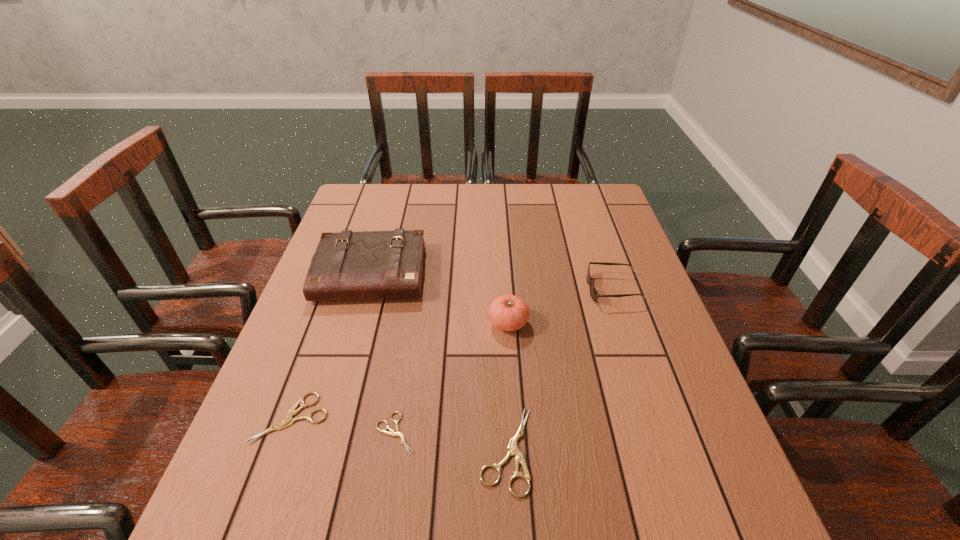
Find the location of a particular element. vacant area situated 0.320m on the back of the shortest shears is located at coordinates (416, 303).

The width and height of the screenshot is (960, 540). Find the location of `vacant space situated 0.370m on the back of the rightmost shears`. vacant space situated 0.370m on the back of the rightmost shears is located at coordinates (499, 288).

Where is `blank space located on the left of the tomato`? Image resolution: width=960 pixels, height=540 pixels. blank space located on the left of the tomato is located at coordinates (371, 323).

Image resolution: width=960 pixels, height=540 pixels. Identify the location of free region located on the back of the hardback book. (390, 205).

Find the location of a particular element. The image size is (960, 540). vacant space situated on the lenses of the sunglasses is located at coordinates (562, 289).

At what (x,y) coordinates should I click in order to perform the action: click on vacant region located 0.210m on the lenses of the sunglasses. Please return your answer as a coordinate pair (x, y). The image size is (960, 540). Looking at the image, I should click on [509, 289].

Identify the location of vacant space situated on the lenses of the sunglasses. Image resolution: width=960 pixels, height=540 pixels. (546, 289).

Where is `shears located at the left edge`? shears located at the left edge is located at coordinates (288, 421).

Where is `hardback book at the left edge`? The image size is (960, 540). hardback book at the left edge is located at coordinates (347, 265).

In order to click on object that is at the right edge in this screenshot , I will do `click(594, 294)`.